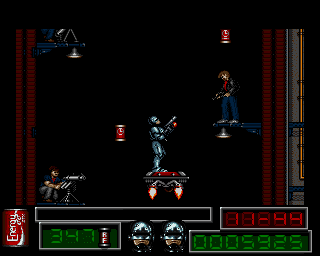
The height and width of the screenshot is (256, 320). I want to click on silver/gray wall, so click(x=297, y=134).